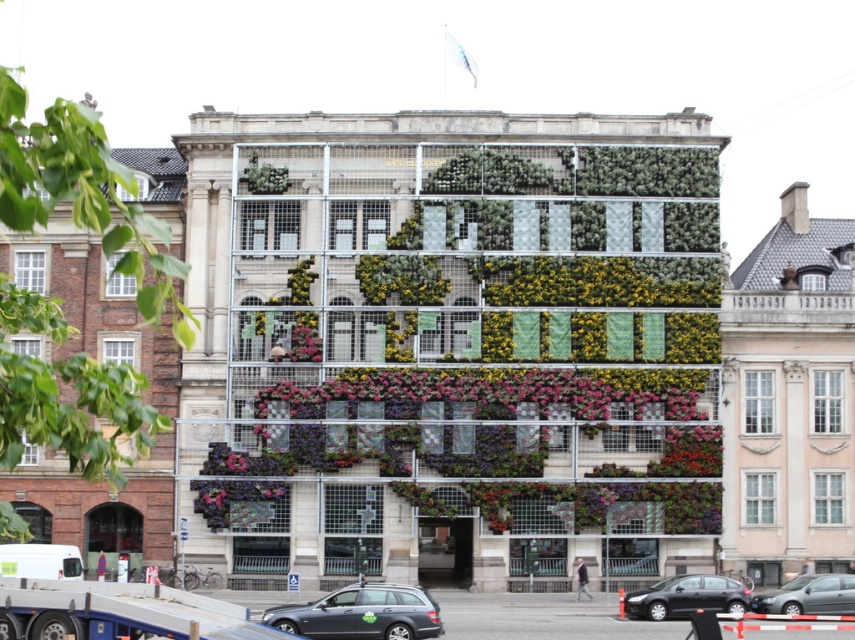
Who is more distant from viewer, (357, 596) or (624, 600)?

Positioned behind is point (624, 600).

Can you confirm if matte gray station wagon at lower center is positioned to the right of black glossy car at lower right?

Incorrect, matte gray station wagon at lower center is not on the right side of black glossy car at lower right.

Between point (366, 582) and point (693, 584), which one is positioned behind?

The point (693, 584) is more distant.

Where is `matte gray station wagon at lower center`? matte gray station wagon at lower center is located at coordinates (361, 612).

Does black glossy car at lower right have a lesser height compared to metallic silver sedan at center?

No.

Consider the image. Who is taller, black glossy car at lower right or metallic silver sedan at center?

With more height is black glossy car at lower right.

I want to click on black glossy car at lower right, so click(687, 596).

Between matte gray station wagon at lower center and metallic silver sedan at center, which one is positioned higher?

matte gray station wagon at lower center is above.

Which is behind, point (328, 609) or point (842, 602)?

The point (842, 602) is more distant.

Is point (298, 634) positioned in front of point (797, 589)?

Yes, point (298, 634) is in front of point (797, 589).

This screenshot has width=855, height=640. I want to click on matte gray station wagon at lower center, so click(x=361, y=612).